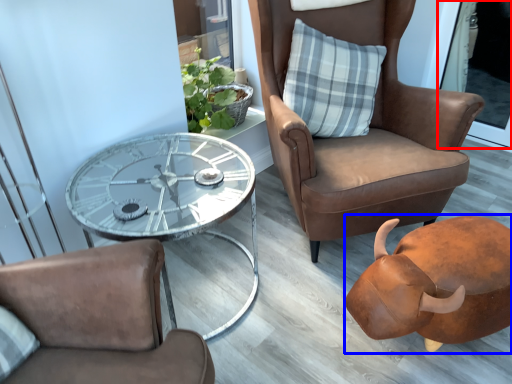
Question: Which point is closer to the camera, screen door (highlighted by a red box) or piggy bank (highlighted by a blue box)?

Choices:
 (A) screen door
 (B) piggy bank

Answer: (B)